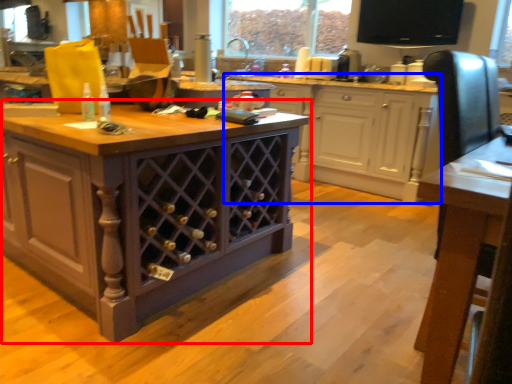
Question: Which point is closer to the camera, cabinetry (highlighted by a red box) or cabinetry (highlighted by a blue box)?

Choices:
 (A) cabinetry
 (B) cabinetry

Answer: (A)